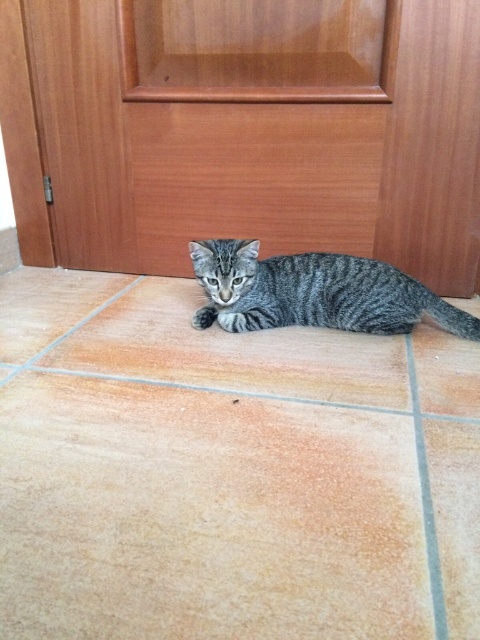
Question: Does brown tile at center have a larger size compared to gray striped cat at center?

Choices:
 (A) no
 (B) yes

Answer: (B)

Question: Which of the following is the closest to the observer?

Choices:
 (A) wooden door at center
 (B) gray striped cat at center

Answer: (A)

Question: Is wooden door at center wider than gray striped cat at center?

Choices:
 (A) yes
 (B) no

Answer: (A)

Question: Can you confirm if wooden door at center is positioned above gray striped cat at center?

Choices:
 (A) yes
 (B) no

Answer: (A)

Question: Which of the following is the closest to the observer?

Choices:
 (A) gray striped cat at center
 (B) wooden door at center

Answer: (B)

Question: Which of the following is the closest to the observer?

Choices:
 (A) wooden door at center
 (B) brown tile at center

Answer: (B)